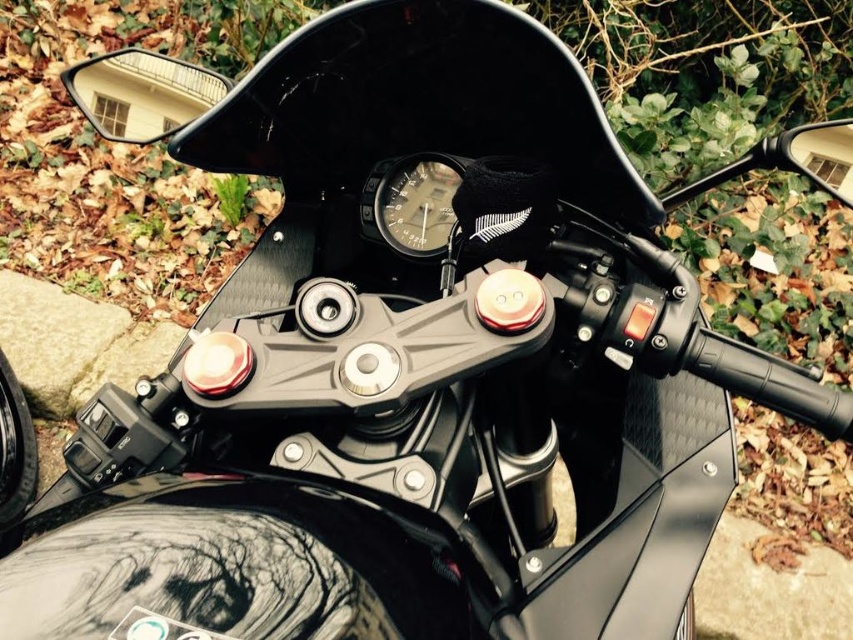
Question: Can you confirm if matte black mirror at upper left is positioned above glossy black mirror at upper right?

Choices:
 (A) yes
 (B) no

Answer: (A)

Question: Which point is farther to the camera?

Choices:
 (A) (73, 84)
 (B) (781, 164)

Answer: (A)

Question: Which object is farther from the camera taking this photo?

Choices:
 (A) glossy black mirror at upper right
 (B) matte black speedometer at center
 (C) matte black mirror at upper left

Answer: (C)

Question: In this image, where is matte black mirror at upper left located relative to matte black speedometer at center?

Choices:
 (A) left
 (B) right

Answer: (A)

Question: Which of the following is the closest to the observer?

Choices:
 (A) glossy black mirror at upper right
 (B) matte black mirror at upper left
 (C) matte black speedometer at center

Answer: (A)

Question: Observing the image, what is the correct spatial positioning of matte black speedometer at center in reference to glossy black mirror at upper right?

Choices:
 (A) above
 (B) below

Answer: (B)